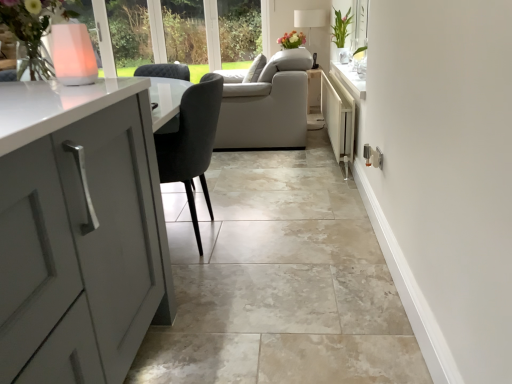
Question: Can you confirm if pink translucent vase at upper left is shorter than matte pink flowers at upper center?

Choices:
 (A) no
 (B) yes

Answer: (B)

Question: Is pink translucent vase at upper left taller than matte pink flowers at upper center?

Choices:
 (A) no
 (B) yes

Answer: (A)

Question: From the image's perspective, is pink translucent vase at upper left on matte pink flowers at upper center?

Choices:
 (A) yes
 (B) no

Answer: (B)

Question: Could you tell me if pink translucent vase at upper left is facing matte pink flowers at upper center?

Choices:
 (A) no
 (B) yes

Answer: (B)

Question: Are pink translucent vase at upper left and matte pink flowers at upper center far apart?

Choices:
 (A) yes
 (B) no

Answer: (A)

Question: From a real-world perspective, is pink translucent vase at upper left positioned over matte pink flowers at upper center based on gravity?

Choices:
 (A) no
 (B) yes

Answer: (B)

Question: Is white glossy vase at upper right outside white metallic radiator at center-right?

Choices:
 (A) yes
 (B) no

Answer: (A)

Question: Is white glossy vase at upper right not near white metallic radiator at center-right?

Choices:
 (A) yes
 (B) no

Answer: (A)

Question: From the image's perspective, is white glossy vase at upper right located above white metallic radiator at center-right?

Choices:
 (A) no
 (B) yes

Answer: (B)

Question: Considering the relative sizes of white glossy vase at upper right and white metallic radiator at center-right in the image provided, is white glossy vase at upper right wider than white metallic radiator at center-right?

Choices:
 (A) no
 (B) yes

Answer: (B)

Question: Is white glossy vase at upper right directly adjacent to white metallic radiator at center-right?

Choices:
 (A) yes
 (B) no

Answer: (B)

Question: Does white glossy vase at upper right have a larger size compared to white metallic radiator at center-right?

Choices:
 (A) yes
 (B) no

Answer: (B)

Question: Does white fabric lampshade at upper center have a greater height compared to pink translucent vase at upper left?

Choices:
 (A) yes
 (B) no

Answer: (A)